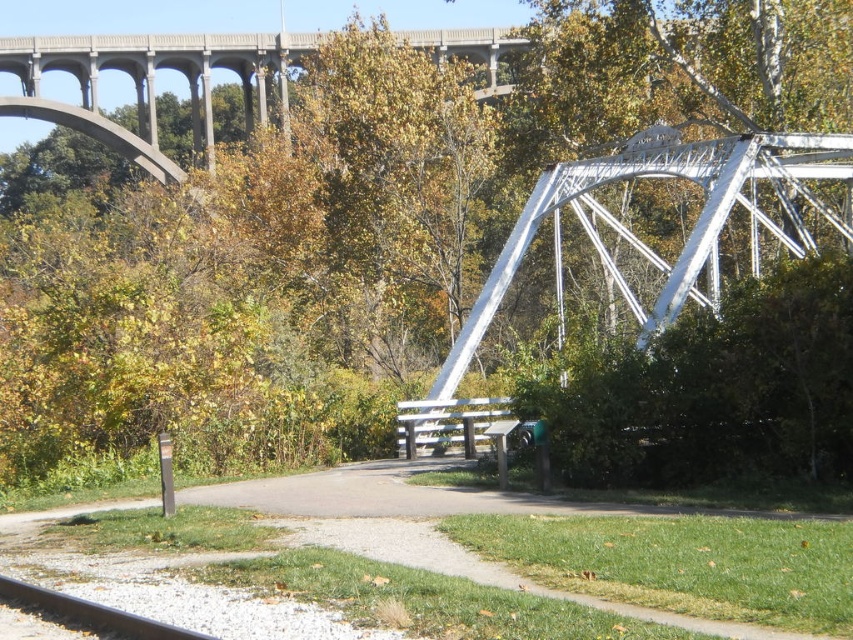
You are a hiker carrying a large backpack and need to cross the gravel path at center and the smooth steel rail at lower left. Which one do you think will be easier to walk on with your heavy load?

The gravel path at center is larger in size than smooth steel rail at lower left, so it will provide a more stable surface for walking with a heavy load.

You are a visitor at the park and want to sit on the wooden park bench at center. As you approach, you notice the smooth steel rail at lower left. Which object is closer to your current position?

The smooth steel rail at lower left is positioned on the left side of the wooden park bench at center, so it is closer to your current position.